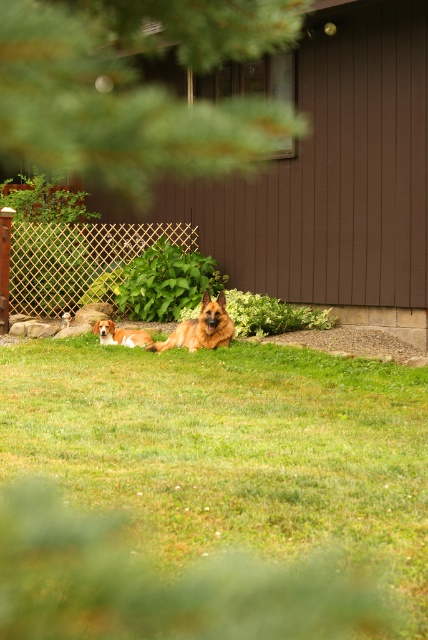
Question: Considering the real-world distances, which object is closest to the golden fur dog at center?

Choices:
 (A) green grass at center
 (B) light brown fur at lower left

Answer: (B)

Question: Among these points, which one is nearest to the camera?

Choices:
 (A) (412, 408)
 (B) (207, 320)

Answer: (A)

Question: Does green grass at center have a lesser width compared to golden fur dog at center?

Choices:
 (A) no
 (B) yes

Answer: (A)

Question: Which object is closer to the camera taking this photo?

Choices:
 (A) green grass at center
 (B) golden fur dog at center

Answer: (A)

Question: Does golden fur dog at center have a smaller size compared to light brown fur at lower left?

Choices:
 (A) yes
 (B) no

Answer: (B)

Question: Observing the image, what is the correct spatial positioning of green grass at center in reference to golden fur dog at center?

Choices:
 (A) above
 (B) below

Answer: (B)